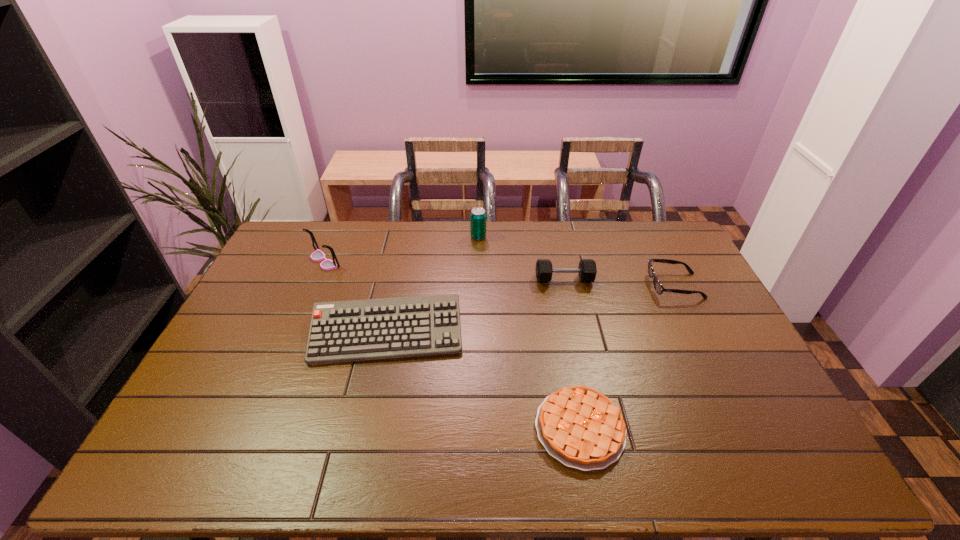
Where is `the fourth object from right to left`? The image size is (960, 540). the fourth object from right to left is located at coordinates (478, 215).

Where is `the farthest object`? This screenshot has height=540, width=960. the farthest object is located at coordinates (478, 215).

Identify the location of the left spectacles. (318, 255).

Locate an element on the screen. The image size is (960, 540). the fourth shortest object is located at coordinates (587, 270).

Where is `computer keyboard`? computer keyboard is located at coordinates (358, 330).

The image size is (960, 540). In order to click on the rightmost object in this screenshot , I will do `click(659, 288)`.

Identify the location of the shorter spectacles. (659, 288).

Locate an element on the screen. pie is located at coordinates (580, 427).

You are a GUI agent. You are given a task and a screenshot of the screen. Output one action in this format:
    pyautogui.click(x=<x>, y=<y>)
    Task: Click on the shortest object
    The height and width of the screenshot is (540, 960).
    Given the screenshot: What is the action you would take?
    pyautogui.click(x=580, y=427)

The image size is (960, 540). What are the coordinates of `free region located on the front of the farthest object` in the screenshot? It's located at (478, 268).